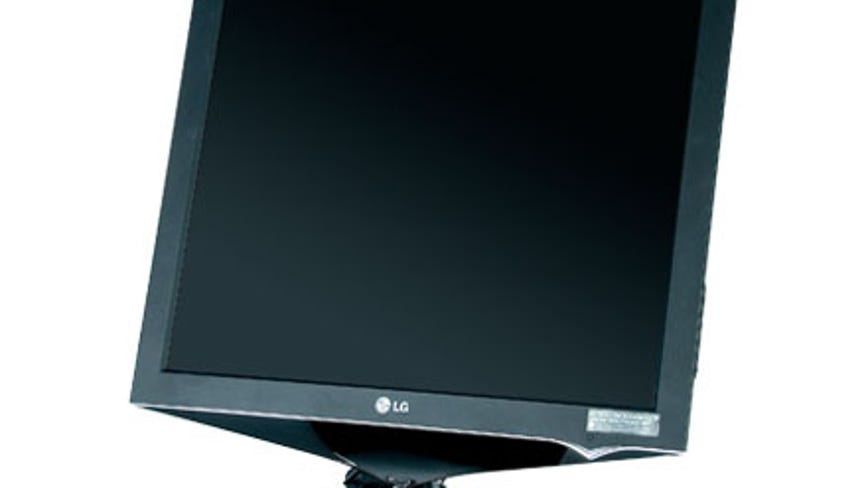
At what (x,y) coordinates should I click in order to perform the action: click on monitor. Please return your answer as a coordinate pair (x, y). The image size is (868, 488). Looking at the image, I should click on (521, 253).